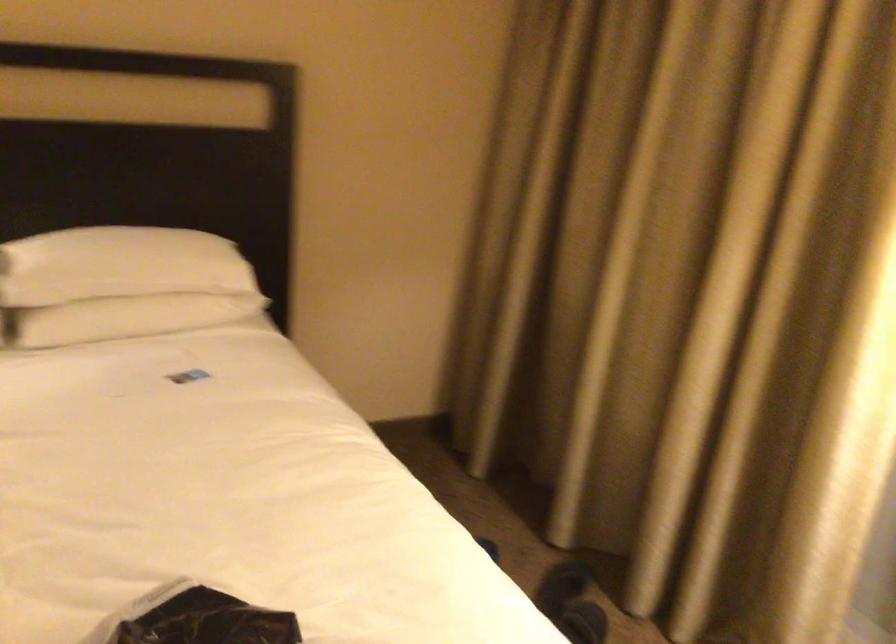
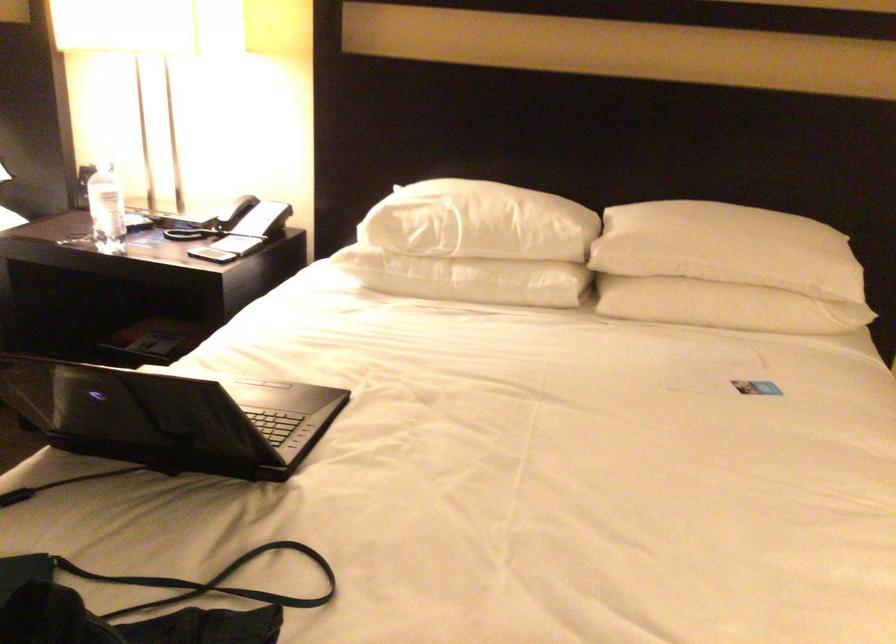
The point at (138, 285) is marked in the first image. Where is the corresponding point in the second image?

(727, 269)